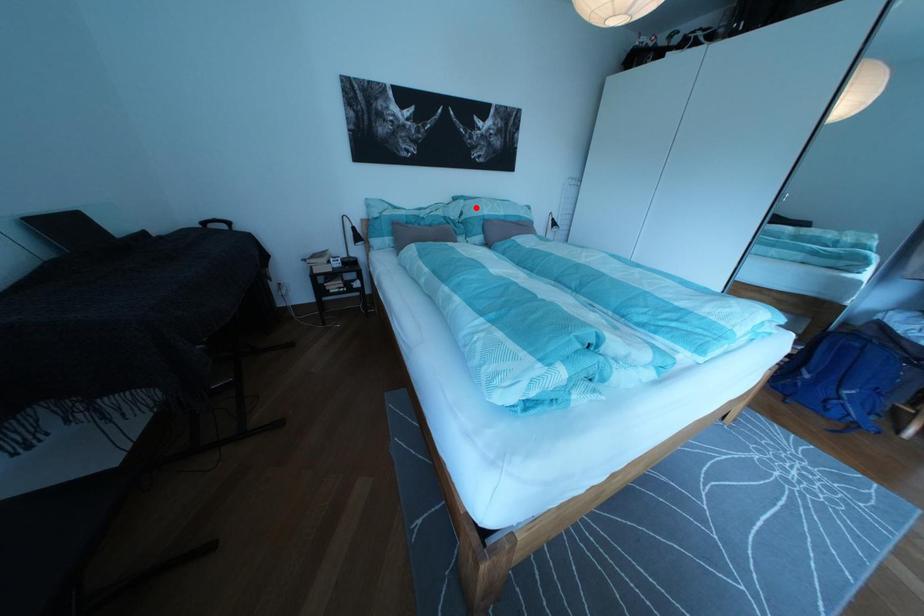
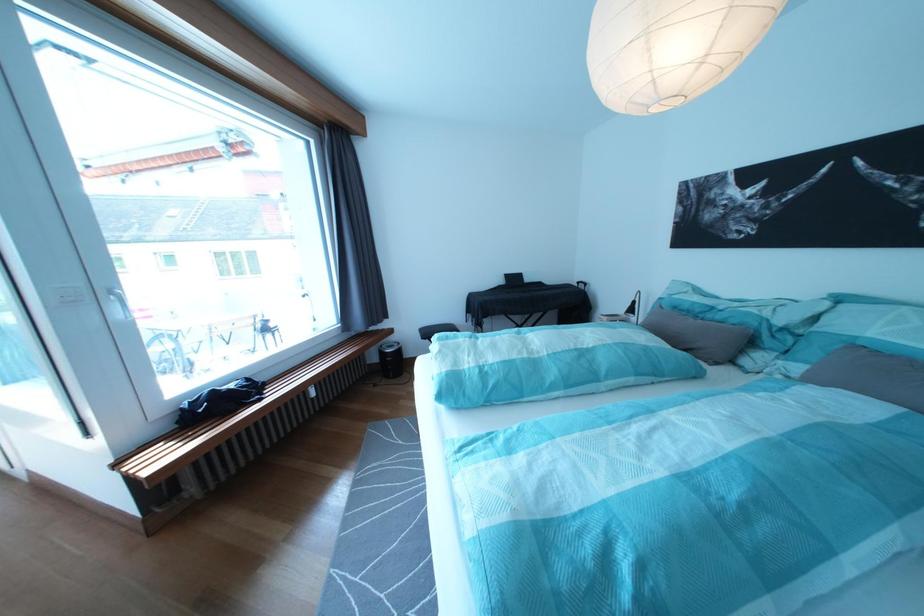
Question: A red point is marked in image1. In image2, is the corresponding 3D point closer to the camera or farther? Reply with the corresponding letter.

Choices:
 (A) The corresponding 3D point is closer.
 (B) The corresponding 3D point is farther.

Answer: (B)